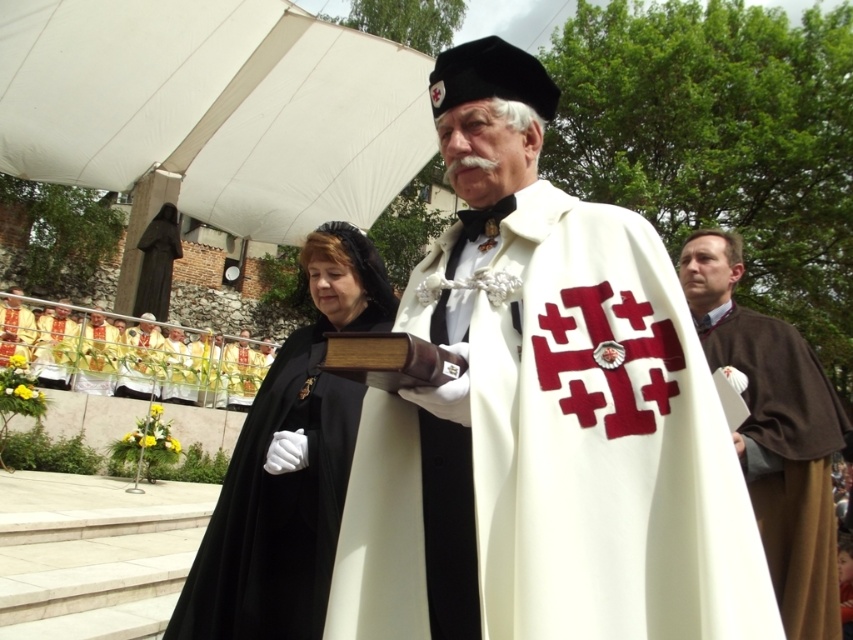
Question: Which object is closer to the camera taking this photo?

Choices:
 (A) white woolen robe at center
 (B) black velvet cape at center
 (C) white matte cape at center

Answer: (C)

Question: Which object is positioned farthest from the brown woolen robe at right?

Choices:
 (A) black velvet cape at center
 (B) matte gold cross at lower left

Answer: (B)

Question: Can you confirm if white matte cape at center is positioned below white woolen robe at center?

Choices:
 (A) yes
 (B) no

Answer: (A)

Question: From the image, what is the correct spatial relationship of white matte cape at center in relation to white woolen robe at center?

Choices:
 (A) above
 (B) below

Answer: (B)

Question: From the image, what is the correct spatial relationship of white matte cape at center in relation to matte gold cross at lower left?

Choices:
 (A) below
 (B) above

Answer: (A)

Question: Among these points, which one is nearest to the camera?

Choices:
 (A) (556, 234)
 (B) (770, 323)
 (C) (142, 340)
 (D) (0, 337)

Answer: (A)